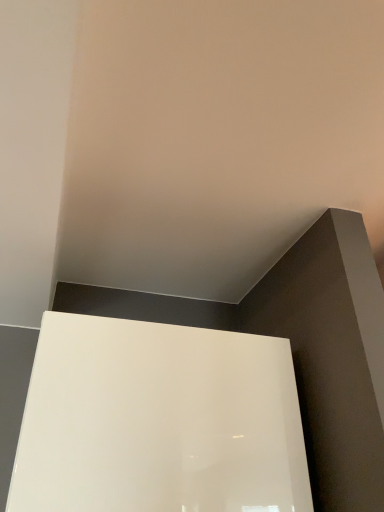
Find the location of `glossy white bath at lower left`. glossy white bath at lower left is located at coordinates (159, 421).

This screenshot has height=512, width=384. What do you see at coordinates (159, 421) in the screenshot? I see `glossy white bath at lower left` at bounding box center [159, 421].

You are a GUI agent. You are given a task and a screenshot of the screen. Output one action in this format:
    pyautogui.click(x=<x>, y=<y>)
    Task: Click on the glossy white bath at lower left
    The width and height of the screenshot is (384, 512).
    Given the screenshot: What is the action you would take?
    pyautogui.click(x=159, y=421)